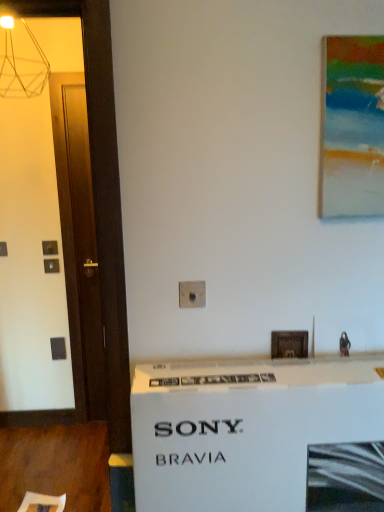
Find the location of a particular element. acrylic painting at upper right, the 1th picture frame positioned from the right is located at coordinates (352, 127).

What is the approximate width of wooden picture frame at center, the second picture frame from the front?

It is 0.84 inches.

In the scene shown: What is the approximate height of wooden picture frame at center, which is the first picture frame in bottom-to-top order?

It is 5.53 inches.

Locate an element on the screen. This screenshot has height=512, width=384. acrylic painting at upper right, the 1th picture frame from the top is located at coordinates (352, 127).

From the picture: Is acrylic painting at upper right, the 1th picture frame positioned from the right, touching white cardboard box at center?

No, acrylic painting at upper right, the 1th picture frame positioned from the right, is not beside white cardboard box at center.

Considering their positions, is acrylic painting at upper right, marked as the second picture frame in a bottom-to-top arrangement, located in front of or behind white cardboard box at center?

acrylic painting at upper right, marked as the second picture frame in a bottom-to-top arrangement, is behind white cardboard box at center.

Considering the sizes of objects acrylic painting at upper right, marked as the second picture frame in a bottom-to-top arrangement, and white cardboard box at center in the image provided, who is shorter, acrylic painting at upper right, marked as the second picture frame in a bottom-to-top arrangement, or white cardboard box at center?

acrylic painting at upper right, marked as the second picture frame in a bottom-to-top arrangement.

Is white cardboard box at center located within acrylic painting at upper right, marked as the second picture frame in a bottom-to-top arrangement?

No, white cardboard box at center is located outside of acrylic painting at upper right, marked as the second picture frame in a bottom-to-top arrangement.

Considering the sizes of objects wooden picture frame at center, the second picture frame viewed from the right, and white cardboard box at center in the image provided, who is taller, wooden picture frame at center, the second picture frame viewed from the right, or white cardboard box at center?

Standing taller between the two is white cardboard box at center.

Between wooden picture frame at center, placed as the first picture frame when sorted from left to right, and white cardboard box at center, which one is positioned behind?

wooden picture frame at center, placed as the first picture frame when sorted from left to right, is further away from the camera.

Can you tell me how much wooden picture frame at center, which is the first picture frame in bottom-to-top order, and white cardboard box at center differ in facing direction?

The angular difference between wooden picture frame at center, which is the first picture frame in bottom-to-top order, and white cardboard box at center is 0.536 degrees.

Is wooden picture frame at center, the second picture frame viewed from the right, wider or thinner than white cardboard box at center?

In the image, wooden picture frame at center, the second picture frame viewed from the right, appears to be more narrow than white cardboard box at center.

Is there a large distance between wooden picture frame at center, which is counted as the second picture frame, starting from the top, and acrylic painting at upper right, marked as the second picture frame in a bottom-to-top arrangement?

No, wooden picture frame at center, which is counted as the second picture frame, starting from the top, is not far away from acrylic painting at upper right, marked as the second picture frame in a bottom-to-top arrangement.

From a real-world perspective, is wooden picture frame at center, placed as the first picture frame when sorted from left to right, physically located above or below acrylic painting at upper right, the second picture frame in the left-to-right sequence?

In terms of real-world spatial position, wooden picture frame at center, placed as the first picture frame when sorted from left to right, is below acrylic painting at upper right, the second picture frame in the left-to-right sequence.

Which object is positioned more to the right, wooden picture frame at center, which is counted as the second picture frame, starting from the top, or acrylic painting at upper right, which appears as the 2th picture frame when viewed from the back?

Positioned to the right is acrylic painting at upper right, which appears as the 2th picture frame when viewed from the back.

From the image's perspective, does wooden picture frame at center, marked as the 1th picture frame in a back-to-front arrangement, appear higher than acrylic painting at upper right, which appears as the 2th picture frame when viewed from the back?

No.

Considering the positions of objects white cardboard box at center and acrylic painting at upper right, which appears as the 2th picture frame when viewed from the back, in the image provided, who is more to the left, white cardboard box at center or acrylic painting at upper right, which appears as the 2th picture frame when viewed from the back,?

From the viewer's perspective, white cardboard box at center appears more on the left side.

Is white cardboard box at center oriented towards acrylic painting at upper right, the 1th picture frame positioned from the right?

No, white cardboard box at center is not facing towards acrylic painting at upper right, the 1th picture frame positioned from the right.

Is white cardboard box at center taller or shorter than acrylic painting at upper right, the 1th picture frame positioned from the right?

Clearly, white cardboard box at center is taller compared to acrylic painting at upper right, the 1th picture frame positioned from the right.

From the picture: From their relative heights in the image, would you say acrylic painting at upper right, which appears as the 2th picture frame when viewed from the back, is taller or shorter than wooden picture frame at center, the second picture frame viewed from the right?

Considering their sizes, acrylic painting at upper right, which appears as the 2th picture frame when viewed from the back, has more height than wooden picture frame at center, the second picture frame viewed from the right.

Would you say acrylic painting at upper right, the 1th picture frame positioned from the right, is to the left or to the right of wooden picture frame at center, marked as the 1th picture frame in a back-to-front arrangement, in the picture?

From the image, it's evident that acrylic painting at upper right, the 1th picture frame positioned from the right, is to the right of wooden picture frame at center, marked as the 1th picture frame in a back-to-front arrangement.

Does acrylic painting at upper right, marked as the second picture frame in a bottom-to-top arrangement, have a greater width compared to wooden picture frame at center, which is counted as the second picture frame, starting from the top?

Yes.

Which of these two, white cardboard box at center or wooden picture frame at center, marked as the 1th picture frame in a back-to-front arrangement, stands shorter?

wooden picture frame at center, marked as the 1th picture frame in a back-to-front arrangement.

Does point (194, 476) come farther from viewer compared to point (291, 345)?

That is False.

Between white cardboard box at center and wooden picture frame at center, the second picture frame viewed from the right, which one is positioned behind?

wooden picture frame at center, the second picture frame viewed from the right, is behind.

Is white cardboard box at center oriented away from wooden picture frame at center, which is the first picture frame in bottom-to-top order?

Yes.

Identify the location of counter below the acrylic painting at upper right, the 1th picture frame from the top (from the image's perspective). (256, 434).

Which picture frame is the 2nd one when counting from the back of the white cardboard box at center? Please provide its 2D coordinates.

[(289, 344)]

From the image, which object appears to be nearer to white cardboard box at center, acrylic painting at upper right, the 1th picture frame positioned from the right, or wooden picture frame at center, marked as the 1th picture frame in a back-to-front arrangement?

wooden picture frame at center, marked as the 1th picture frame in a back-to-front arrangement, is positioned closer to the anchor white cardboard box at center.

When comparing their distances from acrylic painting at upper right, positioned as the first picture frame in front-to-back order, does wooden picture frame at center, marked as the 1th picture frame in a back-to-front arrangement, or white cardboard box at center seem closer?

wooden picture frame at center, marked as the 1th picture frame in a back-to-front arrangement.

When comparing their distances from wooden picture frame at center, placed as the first picture frame when sorted from left to right, does white cardboard box at center or acrylic painting at upper right, marked as the second picture frame in a bottom-to-top arrangement, seem closer?

white cardboard box at center lies closer to wooden picture frame at center, placed as the first picture frame when sorted from left to right, than the other object.

When comparing their distances from acrylic painting at upper right, the 1th picture frame from the top, does white cardboard box at center or wooden picture frame at center, which is counted as the second picture frame, starting from the top, seem closer?

Based on the image, wooden picture frame at center, which is counted as the second picture frame, starting from the top, appears to be nearer to acrylic painting at upper right, the 1th picture frame from the top.

Looking at the image, which one is located closer to wooden picture frame at center, which is the first picture frame in bottom-to-top order, acrylic painting at upper right, the 1th picture frame from the top, or white cardboard box at center?

white cardboard box at center is closer to wooden picture frame at center, which is the first picture frame in bottom-to-top order.

In the scene shown: From the image, which object appears to be nearer to white cardboard box at center, wooden picture frame at center, placed as the first picture frame when sorted from left to right, or acrylic painting at upper right, which appears as the 2th picture frame when viewed from the back?

Based on the image, wooden picture frame at center, placed as the first picture frame when sorted from left to right, appears to be nearer to white cardboard box at center.

Locate an element on the screen. This screenshot has width=384, height=512. picture frame that lies between acrylic painting at upper right, the 1th picture frame from the top, and white cardboard box at center from top to bottom is located at coordinates (289, 344).